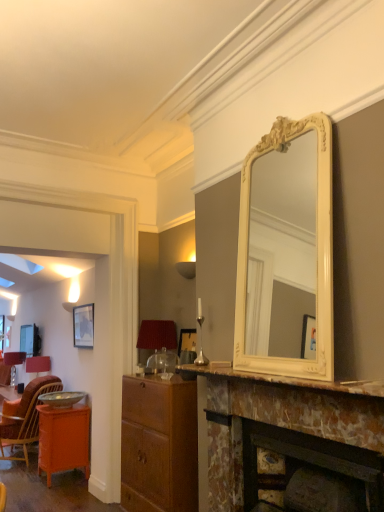
Find the location of a particular element. free region on the left part of orange glossy cabinet at lower left is located at coordinates coord(23,481).